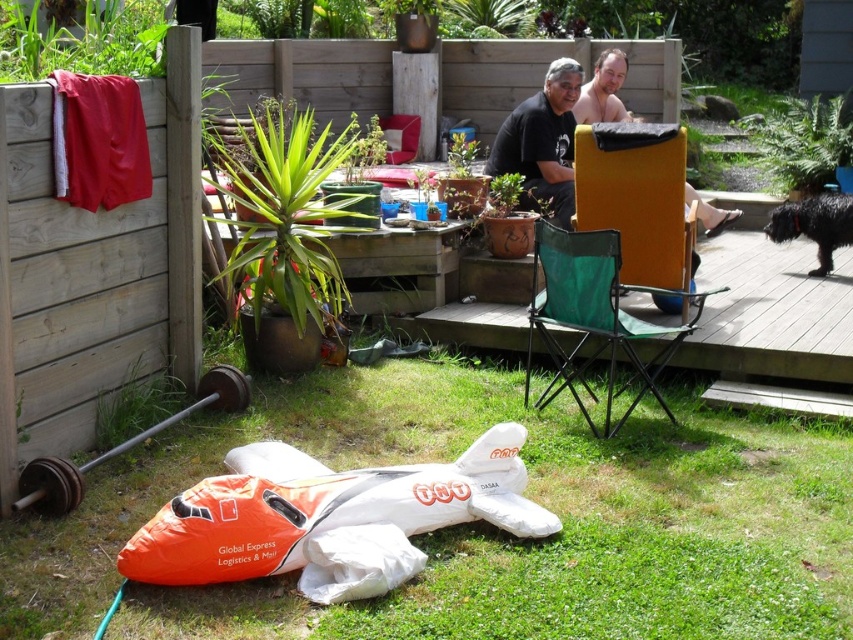
Can you confirm if yellow fabric chair at upper right is taller than matte black shirt at center?

No, yellow fabric chair at upper right is not taller than matte black shirt at center.

Does yellow fabric chair at upper right appear on the left side of matte black shirt at center?

No, yellow fabric chair at upper right is not to the left of matte black shirt at center.

Locate an element on the screen. This screenshot has height=640, width=853. yellow fabric chair at upper right is located at coordinates (637, 205).

Who is shorter, green grass at lower center or orange fabric airplane at lower center?

orange fabric airplane at lower center is shorter.

The image size is (853, 640). What are the coordinates of `green grass at lower center` in the screenshot? It's located at (486, 524).

Where is `green grass at lower center`? The width and height of the screenshot is (853, 640). green grass at lower center is located at coordinates (486, 524).

Is orange fabric airplane at lower center thinner than yellow fabric chair at upper right?

No, orange fabric airplane at lower center is not thinner than yellow fabric chair at upper right.

Does orange fabric airplane at lower center appear on the left side of yellow fabric chair at upper right?

Correct, you'll find orange fabric airplane at lower center to the left of yellow fabric chair at upper right.

Who is more distant from viewer, (184,500) or (665,195)?

The point (665,195) is behind.

Locate an element on the screen. The width and height of the screenshot is (853, 640). orange fabric airplane at lower center is located at coordinates (323, 508).